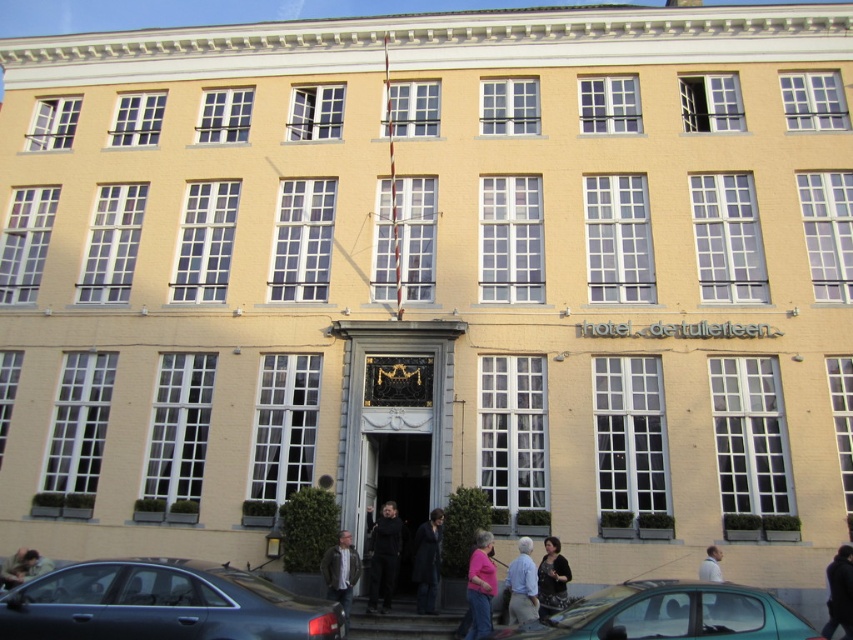
Question: Estimate the real-world distances between objects in this image. Which object is farther from the dark gray wool coat at center?

Choices:
 (A) pink fabric at lower center
 (B) matte black sedan at lower left
 (C) brown leather jacket at lower left
 (D) teal glossy car at lower center

Answer: (C)

Question: Is the position of light blue shirt at lower center less distant than that of matte black jacket at lower left?

Choices:
 (A) yes
 (B) no

Answer: (A)

Question: Is dark gray wool coat at center to the right of matte black jacket at lower left from the viewer's perspective?

Choices:
 (A) no
 (B) yes

Answer: (B)

Question: Is dark gray wool coat at center bigger than light brown leather jacket at center?

Choices:
 (A) no
 (B) yes

Answer: (A)

Question: Considering the real-world distances, which object is farthest from the denim jacket at lower left?

Choices:
 (A) light brown leather jacket at center
 (B) light blue shirt at lower center

Answer: (A)

Question: Which of the following is the farthest from the observer?

Choices:
 (A) light brown leather jacket at center
 (B) matte black sedan at lower left

Answer: (A)